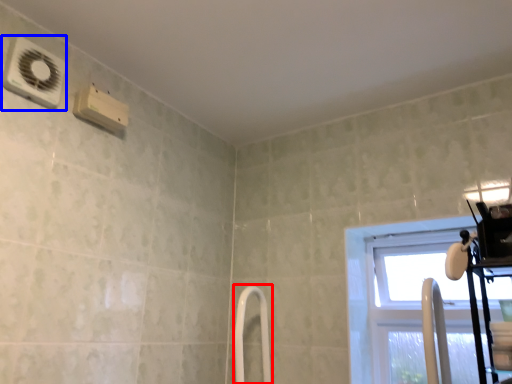
Question: Among these objects, which one is farthest to the camera, shower door (highlighted by a red box) or air conditioning (highlighted by a blue box)?

Choices:
 (A) shower door
 (B) air conditioning

Answer: (A)